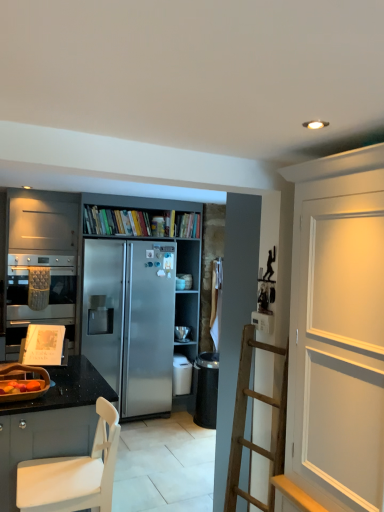
Describe the element at coordinates (182, 333) in the screenshot. I see `satin silver refrigerator at center, the third appliance positioned from the front` at that location.

Image resolution: width=384 pixels, height=512 pixels. What are the coordinates of `satin silver refrigerator at center, the second cabinetry positioned from the front` in the screenshot? It's located at (117, 300).

Identify the location of black granite countertop at lower left, the first cabinetry from the front. The width and height of the screenshot is (384, 512). (51, 422).

What is the approximate height of satin silver refrigerator at center, positioned as the 2th appliance in right-to-left order?

satin silver refrigerator at center, positioned as the 2th appliance in right-to-left order, is 15.43 inches tall.

What is the approximate width of matte silver oven at left?

It is 25.28 inches.

Locate an element on the screen. The height and width of the screenshot is (512, 384). matte silver oven at left is located at coordinates (49, 290).

I want to click on white painted wood door at upper right, so click(x=338, y=330).

Find the location of a particular element. satin silver refrigerator at center, which appears as the second appliance when ordered from the bottom is located at coordinates (182, 333).

Would you say satin silver refrigerator at center, the first appliance in the bottom-to-top sequence, contains satin silver refrigerator at center, the third appliance positioned from the front?

That's incorrect, satin silver refrigerator at center, the third appliance positioned from the front, is not inside satin silver refrigerator at center, the first appliance in the bottom-to-top sequence.

Where is `appliance that is below the satin silver refrigerator at center, placed as the 1th appliance when sorted from back to front (from the image's perspective)`? This screenshot has width=384, height=512. appliance that is below the satin silver refrigerator at center, placed as the 1th appliance when sorted from back to front (from the image's perspective) is located at coordinates (181, 375).

Is satin silver refrigerator at center, positioned as the 2th appliance in right-to-left order, oriented away from satin silver refrigerator at center, placed as the 1th appliance when sorted from back to front?

That's not correct — satin silver refrigerator at center, positioned as the 2th appliance in right-to-left order, is not looking away from satin silver refrigerator at center, placed as the 1th appliance when sorted from back to front.

Between satin silver refrigerator at center, the second appliance positioned from the front, and satin silver refrigerator at center, placed as the 1th appliance when sorted from back to front, which one appears on the right side from the viewer's perspective?

satin silver refrigerator at center, placed as the 1th appliance when sorted from back to front.

Is satin silver refrigerator at center, which ranks as the 2th appliance in back-to-front order, further to camera compared to white painted wood door at upper right?

Yes, satin silver refrigerator at center, which ranks as the 2th appliance in back-to-front order, is further from the viewer.

Based on the photo, from the image's perspective, is satin silver refrigerator at center, positioned as the 2th appliance in right-to-left order, on white painted wood door at upper right?

No, from the image's perspective, satin silver refrigerator at center, positioned as the 2th appliance in right-to-left order, is not above white painted wood door at upper right.

Which of these two, satin silver refrigerator at center, which ranks as the 2th appliance in back-to-front order, or white painted wood door at upper right, is smaller?

satin silver refrigerator at center, which ranks as the 2th appliance in back-to-front order.

Is satin silver refrigerator at center, the 2th appliance from the left, not inside white painted wood door at upper right?

satin silver refrigerator at center, the 2th appliance from the left, is positioned outside white painted wood door at upper right.

Looking at this image, is white painted wood door at upper right positioned beyond the bounds of wooden fruit basket at lower left, which is counted as the 3th appliance, starting from the back?

white painted wood door at upper right lies outside wooden fruit basket at lower left, which is counted as the 3th appliance, starting from the back,'s area.

Is white painted wood door at upper right turned away from wooden fruit basket at lower left, placed as the first appliance when sorted from front to back?

That's not correct — white painted wood door at upper right is not looking away from wooden fruit basket at lower left, placed as the first appliance when sorted from front to back.

Who is smaller, white painted wood door at upper right or wooden fruit basket at lower left, which ranks as the 3th appliance in right-to-left order?

wooden fruit basket at lower left, which ranks as the 3th appliance in right-to-left order.

What's the angular difference between white painted wood door at upper right and wooden fruit basket at lower left, placed as the first appliance when sorted from front to back,'s facing directions?

white painted wood door at upper right and wooden fruit basket at lower left, placed as the first appliance when sorted from front to back, are facing 88.9 degrees away from each other.

Considering the sizes of objects satin silver refrigerator at center, the second cabinetry positioned from the front, and matte silver oven at left in the image provided, who is thinner, satin silver refrigerator at center, the second cabinetry positioned from the front, or matte silver oven at left?

matte silver oven at left.

From a real-world perspective, relative to matte silver oven at left, is satin silver refrigerator at center, the second cabinetry positioned from the front, vertically above or below?

In terms of real-world spatial position, satin silver refrigerator at center, the second cabinetry positioned from the front, is below matte silver oven at left.

Does satin silver refrigerator at center, which ranks as the 1th cabinetry in back-to-front order, appear on the right side of matte silver oven at left?

Indeed, satin silver refrigerator at center, which ranks as the 1th cabinetry in back-to-front order, is positioned on the right side of matte silver oven at left.

Measure the distance from satin silver refrigerator at center, the second cabinetry positioned from the front, to matte silver oven at left.

satin silver refrigerator at center, the second cabinetry positioned from the front, is 16.22 inches from matte silver oven at left.

Is satin silver refrigerator at center, the 2th appliance from the left, to the left of wooden fruit basket at lower left, arranged as the first appliance when viewed from the top, from the viewer's perspective?

Incorrect, satin silver refrigerator at center, the 2th appliance from the left, is not on the left side of wooden fruit basket at lower left, arranged as the first appliance when viewed from the top.

The width and height of the screenshot is (384, 512). What are the coordinates of `the 1st appliance behind when counting from the wooden fruit basket at lower left, the third appliance positioned from the bottom` in the screenshot? It's located at (181, 375).

Can we say satin silver refrigerator at center, which ranks as the 2th appliance in back-to-front order, lies outside wooden fruit basket at lower left, arranged as the first appliance when viewed from the top?

satin silver refrigerator at center, which ranks as the 2th appliance in back-to-front order, lies outside wooden fruit basket at lower left, arranged as the first appliance when viewed from the top,'s area.

From a real-world perspective, which object stands above the other?

From a 3D spatial view, wooden fruit basket at lower left, which ranks as the 3th appliance in right-to-left order, is above.

Consider the image. Is satin silver refrigerator at center, which appears as the 3th appliance when viewed from the left, next to black granite countertop at lower left, arranged as the 2th cabinetry when viewed from the back?

No, satin silver refrigerator at center, which appears as the 3th appliance when viewed from the left, is not making contact with black granite countertop at lower left, arranged as the 2th cabinetry when viewed from the back.

From the image's perspective, which object appears higher, satin silver refrigerator at center, arranged as the 2th appliance when viewed from the top, or black granite countertop at lower left, the first cabinetry from the front?

satin silver refrigerator at center, arranged as the 2th appliance when viewed from the top, is shown above in the image.

Measure the distance between satin silver refrigerator at center, which appears as the 3th appliance when viewed from the left, and black granite countertop at lower left, arranged as the 2th cabinetry when viewed from the back.

satin silver refrigerator at center, which appears as the 3th appliance when viewed from the left, is 2.23 meters from black granite countertop at lower left, arranged as the 2th cabinetry when viewed from the back.

Would you say satin silver refrigerator at center, which appears as the second appliance when ordered from the bottom, is outside black granite countertop at lower left, the first cabinetry from the front?

satin silver refrigerator at center, which appears as the second appliance when ordered from the bottom, lies outside black granite countertop at lower left, the first cabinetry from the front,'s area.

Is white painted wood door at upper right thinner than satin silver refrigerator at center, the second cabinetry positioned from the front?

Correct, the width of white painted wood door at upper right is less than that of satin silver refrigerator at center, the second cabinetry positioned from the front.

From a real-world perspective, between white painted wood door at upper right and satin silver refrigerator at center, the second cabinetry positioned from the front, who is vertically higher?

In real-world perspective, white painted wood door at upper right is above.

From the image's perspective, which one is positioned lower, white painted wood door at upper right or satin silver refrigerator at center, which ranks as the 1th cabinetry in back-to-front order?

satin silver refrigerator at center, which ranks as the 1th cabinetry in back-to-front order.

In the scene shown: Considering the positions of objects white painted wood door at upper right and satin silver refrigerator at center, the second cabinetry positioned from the front, in the image provided, who is more to the right, white painted wood door at upper right or satin silver refrigerator at center, the second cabinetry positioned from the front,?

white painted wood door at upper right.

Find the location of a particular element. appliance on the right side of satin silver refrigerator at center, which ranks as the 2th appliance in back-to-front order is located at coordinates (182, 333).

At what (x,y) coordinates should I click in order to perform the action: click on door above the satin silver refrigerator at center, positioned as the third appliance in top-to-bottom order (from the image's perspective). Please return your answer as a coordinate pair (x, y). Image resolution: width=384 pixels, height=512 pixels. Looking at the image, I should click on (338, 330).

When comparing their distances from matte silver oven at left, does satin silver refrigerator at center, which ranks as the 1th cabinetry in back-to-front order, or satin silver refrigerator at center, which appears as the second appliance when ordered from the bottom, seem further?

Based on the image, satin silver refrigerator at center, which appears as the second appliance when ordered from the bottom, appears to be further to matte silver oven at left.

Estimate the real-world distances between objects in this image. Which object is further from satin silver refrigerator at center, the second cabinetry positioned from the front, satin silver refrigerator at center, which appears as the second appliance when ordered from the bottom, or wooden fruit basket at lower left, the third appliance positioned from the bottom?

Among the two, wooden fruit basket at lower left, the third appliance positioned from the bottom, is located further to satin silver refrigerator at center, the second cabinetry positioned from the front.

Consider the image. From the image, which object appears to be farther from black granite countertop at lower left, the first cabinetry from the front, white painted wood door at upper right or wooden fruit basket at lower left, placed as the first appliance when sorted from front to back?

white painted wood door at upper right lies further to black granite countertop at lower left, the first cabinetry from the front, than the other object.

Estimate the real-world distances between objects in this image. Which object is closer to white painted wood door at upper right, satin silver refrigerator at center, positioned as the 2th appliance in right-to-left order, or black granite countertop at lower left, arranged as the 2th cabinetry when viewed from the back?

Among the two, black granite countertop at lower left, arranged as the 2th cabinetry when viewed from the back, is located nearer to white painted wood door at upper right.

Considering their positions, is satin silver refrigerator at center, which ranks as the 1th cabinetry in back-to-front order, positioned closer to wooden fruit basket at lower left, the third appliance positioned from the bottom, than satin silver refrigerator at center, the first appliance in the bottom-to-top sequence?

satin silver refrigerator at center, which ranks as the 1th cabinetry in back-to-front order, lies closer to wooden fruit basket at lower left, the third appliance positioned from the bottom, than the other object.

From the image, which object appears to be farther from satin silver refrigerator at center, the second cabinetry positioned from the front, satin silver refrigerator at center, the first appliance in the bottom-to-top sequence, or black granite countertop at lower left, arranged as the 2th cabinetry when viewed from the back?

black granite countertop at lower left, arranged as the 2th cabinetry when viewed from the back.

Considering their positions, is satin silver refrigerator at center, the second cabinetry positioned from the front, positioned further to matte silver oven at left than black granite countertop at lower left, arranged as the 2th cabinetry when viewed from the back?

black granite countertop at lower left, arranged as the 2th cabinetry when viewed from the back, is further to matte silver oven at left.

From the image, which object appears to be nearer to satin silver refrigerator at center, positioned as the first appliance in right-to-left order, matte silver oven at left or black granite countertop at lower left, arranged as the 2th cabinetry when viewed from the back?

Among the two, matte silver oven at left is located nearer to satin silver refrigerator at center, positioned as the first appliance in right-to-left order.

At what (x,y) coordinates should I click in order to perform the action: click on cabinetry between wooden fruit basket at lower left, the third appliance positioned from the bottom, and satin silver refrigerator at center, positioned as the 2th appliance in right-to-left order, in the front-back direction. Please return your answer as a coordinate pair (x, y). This screenshot has height=512, width=384. Looking at the image, I should click on (117, 300).

This screenshot has width=384, height=512. Find the location of `appliance positioned between black granite countertop at lower left, the first cabinetry from the front, and satin silver refrigerator at center, the second cabinetry positioned from the front, from near to far`. appliance positioned between black granite countertop at lower left, the first cabinetry from the front, and satin silver refrigerator at center, the second cabinetry positioned from the front, from near to far is located at coordinates [x=25, y=392].

You are a GUI agent. You are given a task and a screenshot of the screen. Output one action in this format:
    pyautogui.click(x=<x>, y=<y>)
    Task: Click on the appliance between black granite countertop at lower left, arranged as the 2th cabinetry when viewed from the back, and satin silver refrigerator at center, which ranks as the 2th appliance in back-to-front order, along the z-axis
    This screenshot has width=384, height=512.
    Given the screenshot: What is the action you would take?
    pyautogui.click(x=25, y=392)

Find the location of a particular element. oven between black granite countertop at lower left, the first cabinetry from the front, and satin silver refrigerator at center, the first appliance in the bottom-to-top sequence, from front to back is located at coordinates (49, 290).